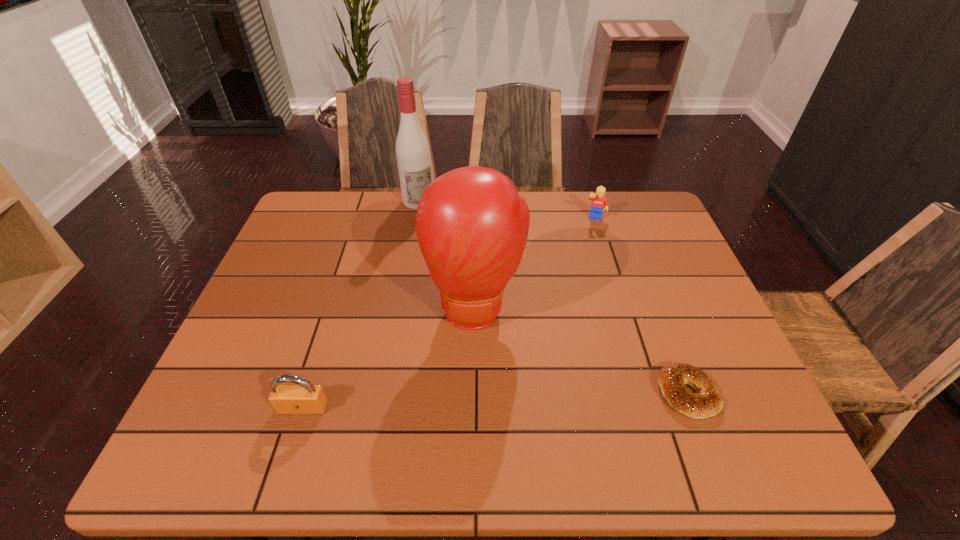
Identify the location of vacant space located 0.130m on the striking surface of the boxing glove. (476, 394).

The width and height of the screenshot is (960, 540). Find the location of `free region located on the label of the fourth object from right to left`. free region located on the label of the fourth object from right to left is located at coordinates (440, 241).

The width and height of the screenshot is (960, 540). In order to click on vacant area situated on the label of the fourth object from right to left in this screenshot , I will do `click(445, 252)`.

Identify the location of vacant position located on the label of the fourth object from right to left. (463, 284).

The width and height of the screenshot is (960, 540). I want to click on free spot located 0.340m on the face of the fourth nearest object, so click(572, 298).

You are a GUI agent. You are given a task and a screenshot of the screen. Output one action in this format:
    pyautogui.click(x=<x>, y=<y>)
    Task: Click on the free location located on the face of the fourth nearest object
    This screenshot has width=960, height=540.
    Given the screenshot: What is the action you would take?
    pyautogui.click(x=581, y=268)

Find the location of `vacant space located 0.340m on the face of the fourth nearest object`. vacant space located 0.340m on the face of the fourth nearest object is located at coordinates (572, 298).

Image resolution: width=960 pixels, height=540 pixels. Identify the location of alcohol at the far edge. tap(412, 149).

Locate an element on the screen. Image resolution: width=960 pixels, height=540 pixels. Lego present at the far edge is located at coordinates (599, 203).

What are the coordinates of `padlock that is at the near edge` in the screenshot? It's located at (303, 398).